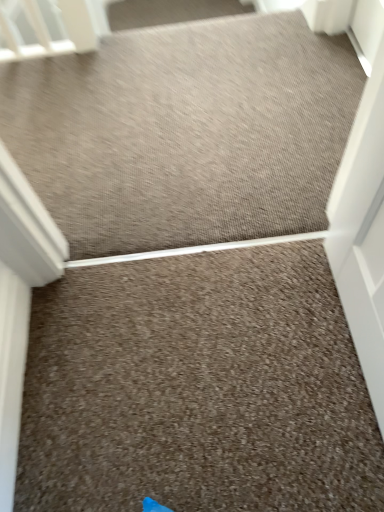
What do you see at coordinates (185, 132) in the screenshot? I see `brown textured mat at center` at bounding box center [185, 132].

The width and height of the screenshot is (384, 512). What are the coordinates of `brown textured mat at center` in the screenshot? It's located at (185, 132).

Measure the distance between point (x=38, y=124) and camera.

Point (x=38, y=124) and camera are 4.78 feet apart from each other.

You are a GUI agent. You are given a task and a screenshot of the screen. Output one action in this format:
    pyautogui.click(x=<x>, y=<y>)
    Task: Click on the brown textured mat at center
    This screenshot has height=512, width=384.
    Given the screenshot: What is the action you would take?
    pyautogui.click(x=185, y=132)